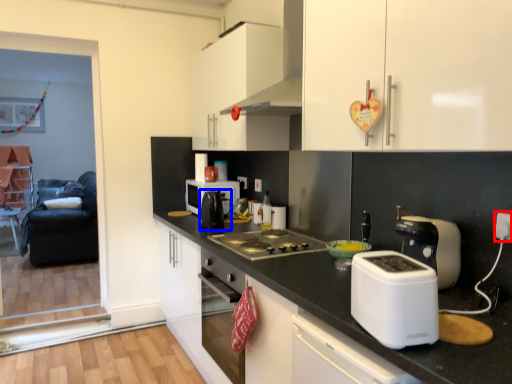
Question: Which point is closer to the camera, electric outlet (highlighted by a red box) or tea pot (highlighted by a blue box)?

Choices:
 (A) electric outlet
 (B) tea pot

Answer: (A)